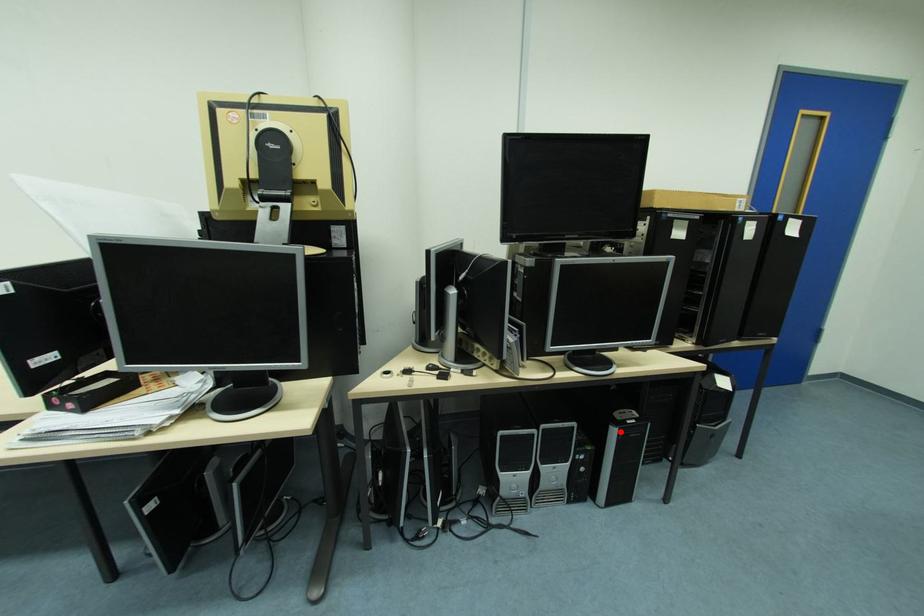
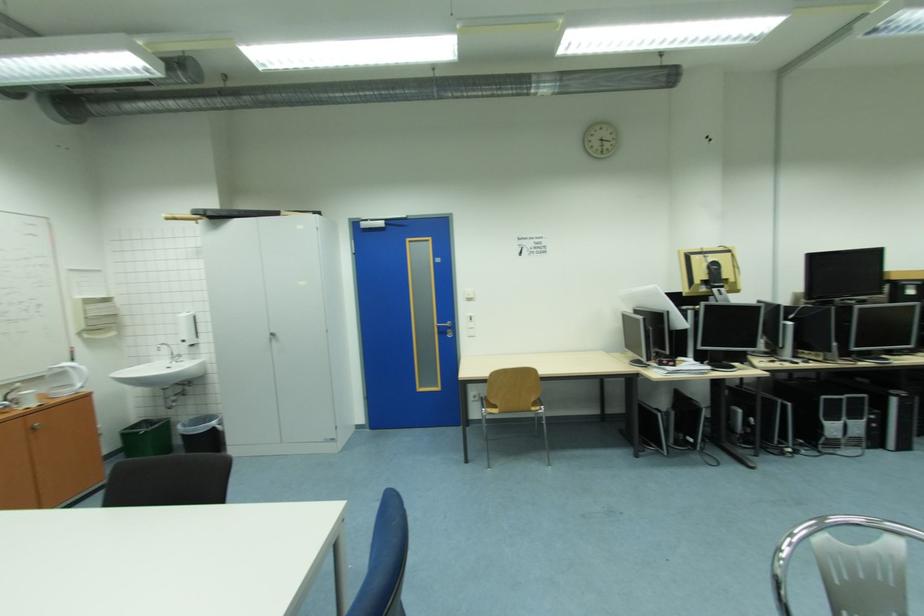
In the second image, find the point that corresponds to the highlighted location in the first image.

(901, 400)